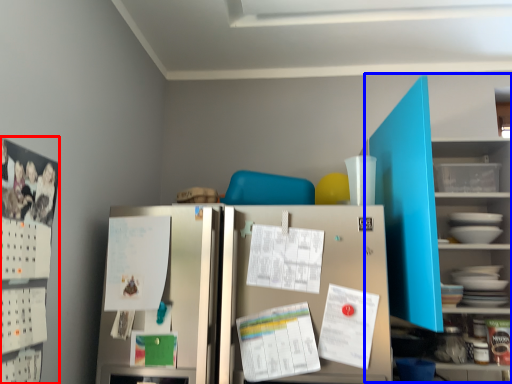
Question: Among these objects, which one is nearest to the camera, bulletin board (highlighted by a red box) or bookshelf (highlighted by a blue box)?

Choices:
 (A) bulletin board
 (B) bookshelf

Answer: (A)